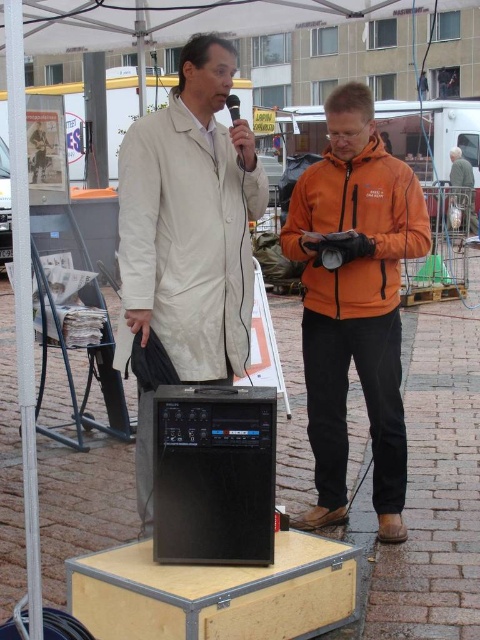
Question: Which point is farther to the camera?

Choices:
 (A) (292, 241)
 (B) (136, 241)

Answer: (A)

Question: Which point appears closest to the camera in this image?

Choices:
 (A) (424, 237)
 (B) (151, 115)

Answer: (B)

Question: Can you confirm if matte white coat at center is positioned below orange fleece jacket at center?

Choices:
 (A) yes
 (B) no

Answer: (B)

Question: Is matte white coat at center smaller than orange fleece jacket at center?

Choices:
 (A) yes
 (B) no

Answer: (A)

Question: Does matte white coat at center have a smaller size compared to orange fleece jacket at center?

Choices:
 (A) yes
 (B) no

Answer: (A)